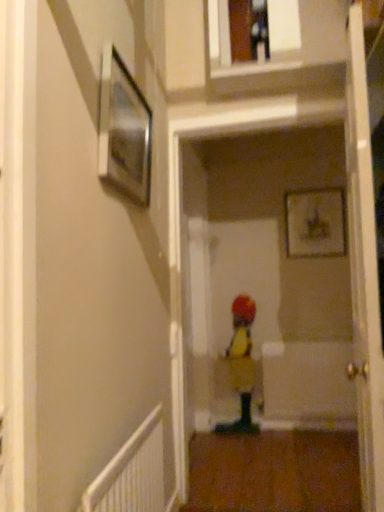
Question: Is yellow fabric toddler at center in front of or behind metallic silver picture frame at upper left, acting as the second picture frame starting from the right, in the image?

Choices:
 (A) behind
 (B) front

Answer: (A)

Question: From a real-world perspective, relative to metallic silver picture frame at upper left, which is counted as the first picture frame, starting from the left, is yellow fabric toddler at center vertically above or below?

Choices:
 (A) below
 (B) above

Answer: (A)

Question: Which object is the farthest from the metallic silver picture frame at upper left, positioned as the first picture frame in front-to-back order?

Choices:
 (A) white glossy door at center
 (B) wooden framed picture at upper center, the second picture frame when ordered from left to right
 (C) white textured radiator at lower left
 (D) yellow fabric toddler at center

Answer: (D)

Question: Which object is positioned farthest from the white glossy door at center?

Choices:
 (A) wooden framed picture at upper center, marked as the first picture frame in a right-to-left arrangement
 (B) metallic silver picture frame at upper left, acting as the second picture frame starting from the right
 (C) yellow fabric toddler at center
 (D) white textured radiator at lower left

Answer: (C)